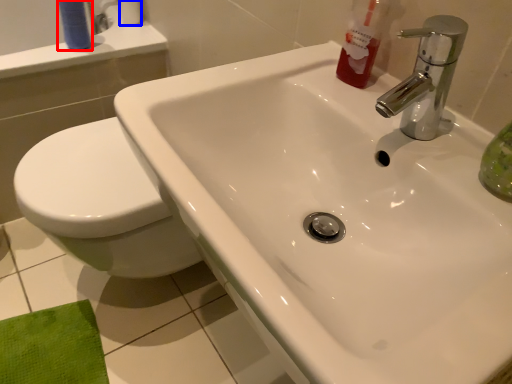
Question: Among these objects, which one is farthest to the camera, toiletry (highlighted by a red box) or toilet paper (highlighted by a blue box)?

Choices:
 (A) toiletry
 (B) toilet paper

Answer: (B)